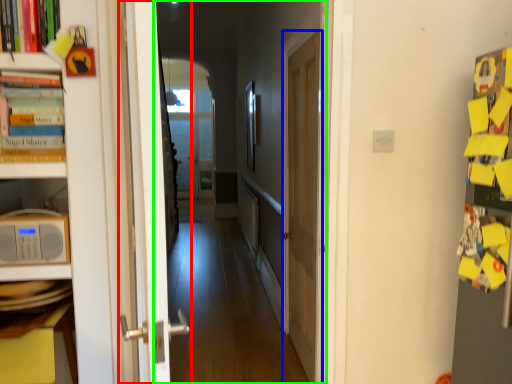
Question: Based on their relative distances, which object is nearer to door (highlighted by a red box)? Choose from door (highlighted by a blue box) and corridor (highlighted by a green box).

Choices:
 (A) door
 (B) corridor

Answer: (A)